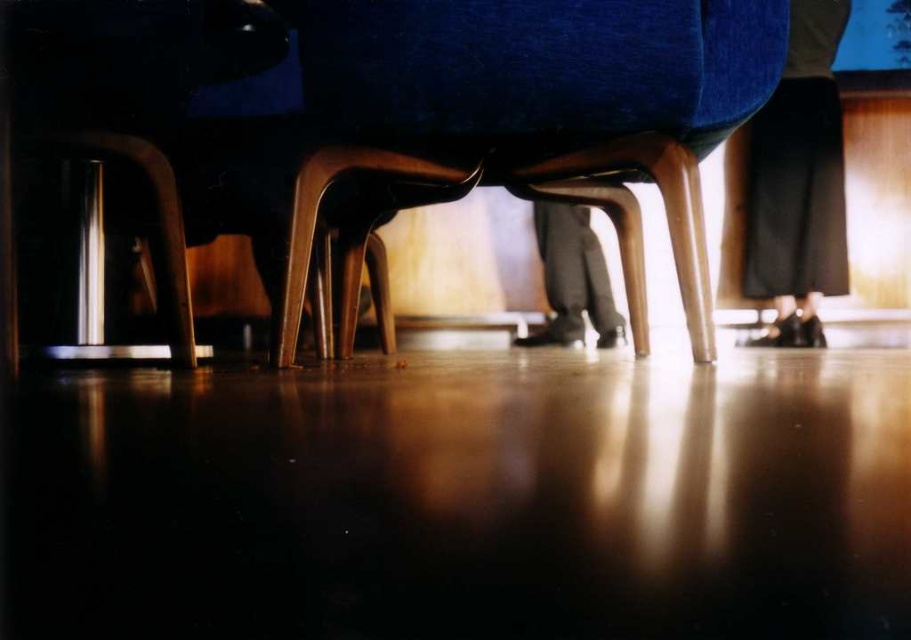
Does dark gray pants at center come behind polished metal bar stool at lower left?

Yes, it is behind polished metal bar stool at lower left.

Which of these two, dark gray pants at center or polished metal bar stool at lower left, stands taller?

With more height is dark gray pants at center.

Image resolution: width=911 pixels, height=640 pixels. What are the coordinates of `dark gray pants at center` in the screenshot? It's located at (572, 278).

Is velvet blue armchair at center below black leather shoes at lower right?

Yes, velvet blue armchair at center is below black leather shoes at lower right.

Based on the photo, which is above, velvet blue armchair at center or black leather shoes at lower right?

black leather shoes at lower right

The width and height of the screenshot is (911, 640). Describe the element at coordinates (551, 92) in the screenshot. I see `velvet blue armchair at center` at that location.

Identify the location of velvet blue armchair at center. (551, 92).

Based on the photo, who is lower down, velvet blue armchair at center or polished metal bar stool at lower left?

polished metal bar stool at lower left is lower down.

Where is `velvet blue armchair at center`? velvet blue armchair at center is located at coordinates (551, 92).

In order to click on velvet blue armchair at center in this screenshot , I will do `click(551, 92)`.